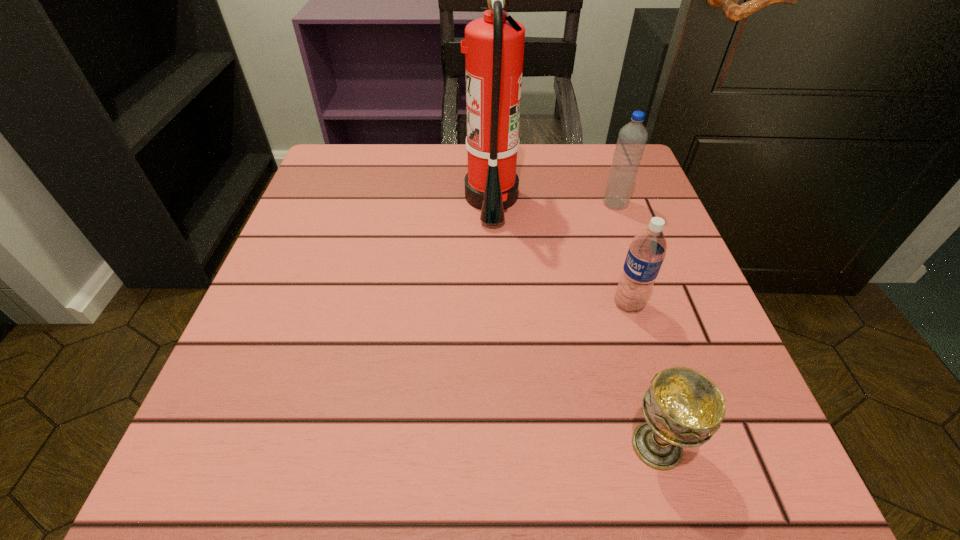
At what (x,y) coordinates should I click in order to perform the action: click on vacant area in the image that satisfies the following two spatial constraints: 1. at the nozzle of the leftmost object; 2. on the left side of the nearest object. Please return your answer as a coordinate pair (x, y). The image size is (960, 540). Looking at the image, I should click on (499, 446).

At what (x,y) coordinates should I click in order to perform the action: click on free space that satisfies the following two spatial constraints: 1. at the nozzle of the leftmost object; 2. on the left side of the chalice. Please return your answer as a coordinate pair (x, y). Looking at the image, I should click on 499,446.

Where is `vacant region that satisfies the following two spatial constraints: 1. on the back side of the farther water bottle; 2. at the nozzle of the leftmost object`? Image resolution: width=960 pixels, height=540 pixels. vacant region that satisfies the following two spatial constraints: 1. on the back side of the farther water bottle; 2. at the nozzle of the leftmost object is located at coordinates (613, 198).

Image resolution: width=960 pixels, height=540 pixels. I want to click on free space that satisfies the following two spatial constraints: 1. on the back side of the farther water bottle; 2. on the left side of the second nearest object, so click(598, 204).